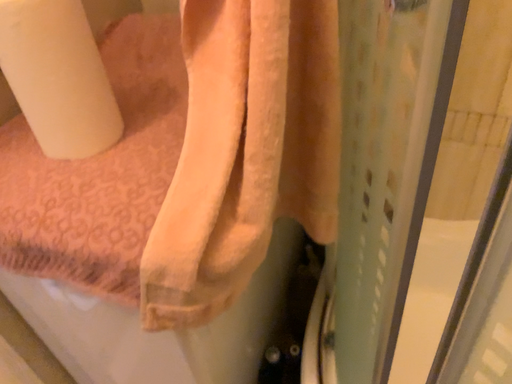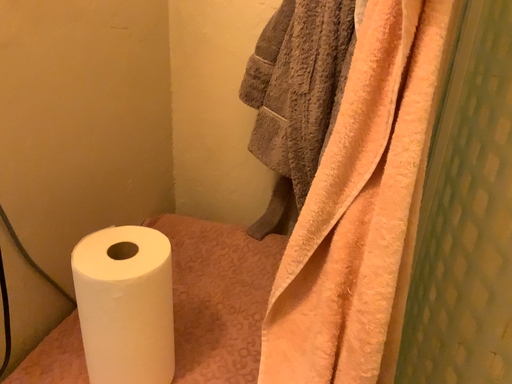
Question: How did the camera likely rotate when shooting the video?

Choices:
 (A) rotated right
 (B) rotated left

Answer: (A)